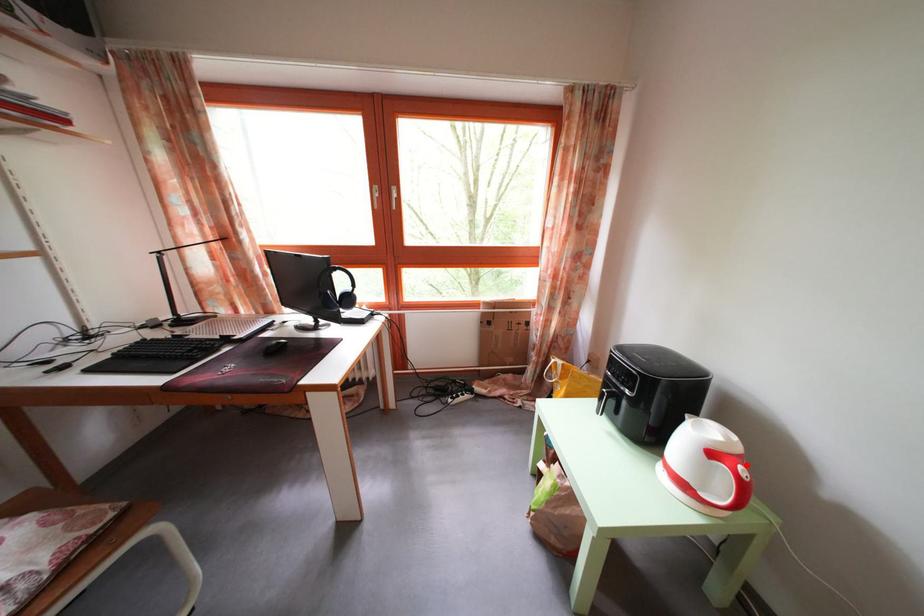
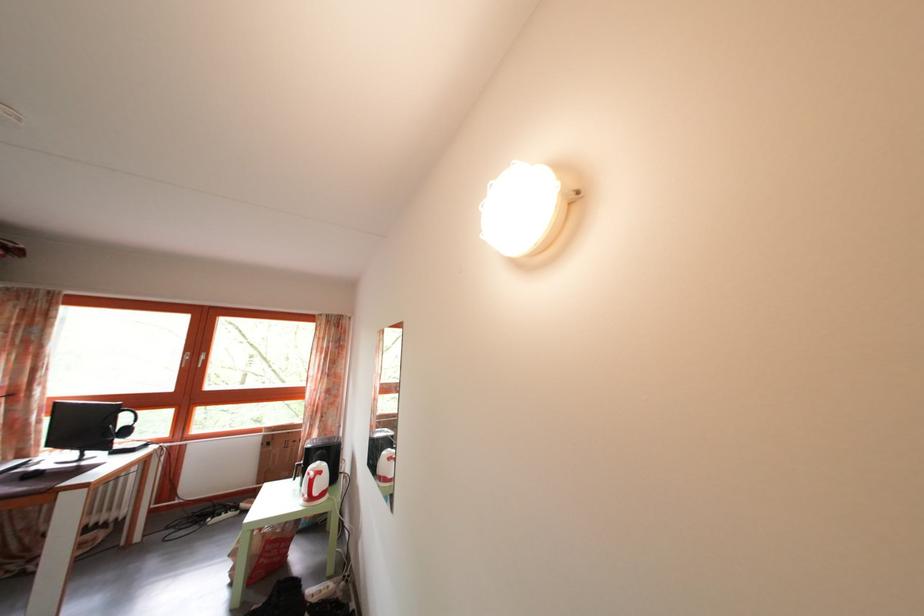
Question: I am providing you with two images of the same scene from different viewpoints. A red point is marked on the first image. At the location where the point appears in image 1, is it still visible in image 2?

Choices:
 (A) Yes
 (B) No

Answer: (A)